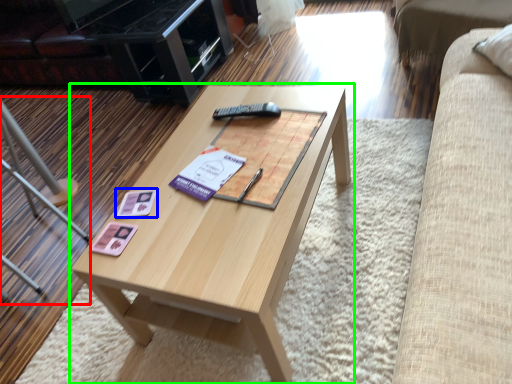
Question: Estimate the real-world distances between objects in this image. Which object is closer to chair (highlighted by a red box), square (highlighted by a blue box) or coffee table (highlighted by a green box)?

Choices:
 (A) square
 (B) coffee table

Answer: (B)